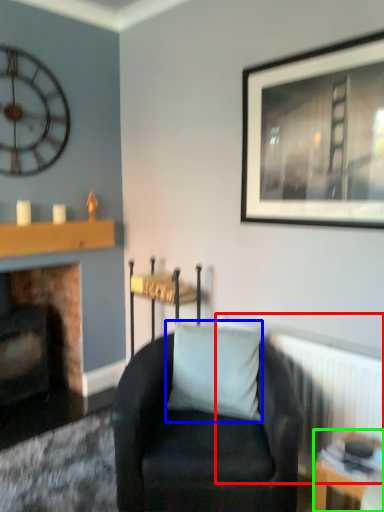
Question: Which object is the closest to the radiator (highlighted by a red box)? Choose among these: pillow (highlighted by a blue box) or table (highlighted by a green box).

Choices:
 (A) pillow
 (B) table

Answer: (B)